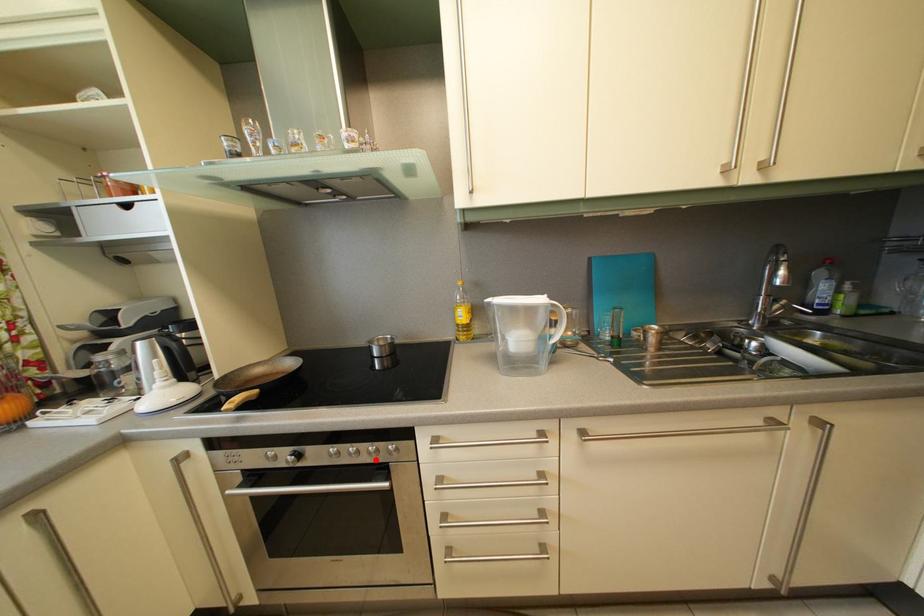
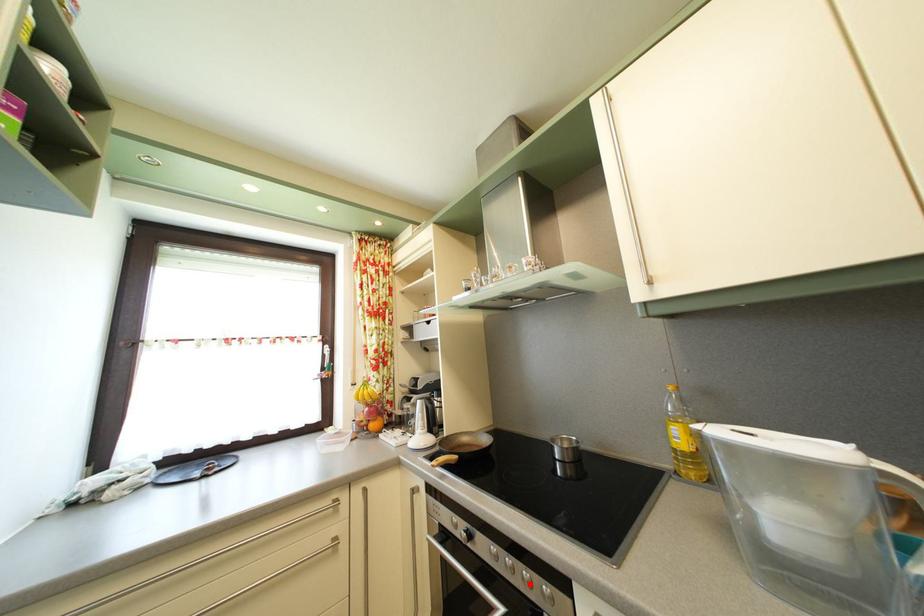
I am providing you with two images of the same scene from different viewpoints. A red point is marked on the first image and another point is marked on the second image. Are the points marked in image1 and image2 representing the same 3D position?

Yes